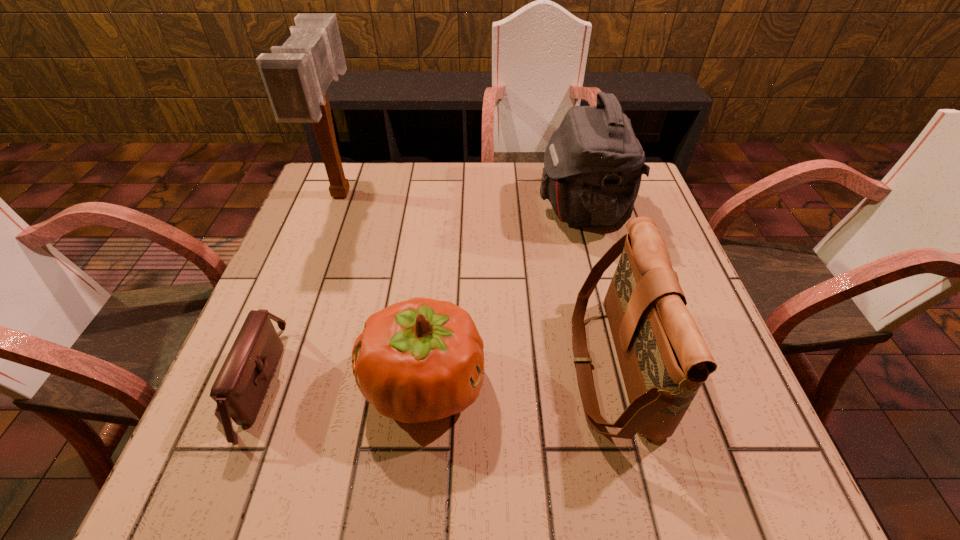
Identify which shoulder bag is the closest to the fourth tallest object. Please provide its 2D coordinates. Your answer should be formatted as a tuple, i.e. [(x, y)], where the tuple contains the x and y coordinates of a point satisfying the conditions above.

[(239, 390)]

Where is `shoulder bag that is the second closest one to the mallet`? shoulder bag that is the second closest one to the mallet is located at coordinates (593, 164).